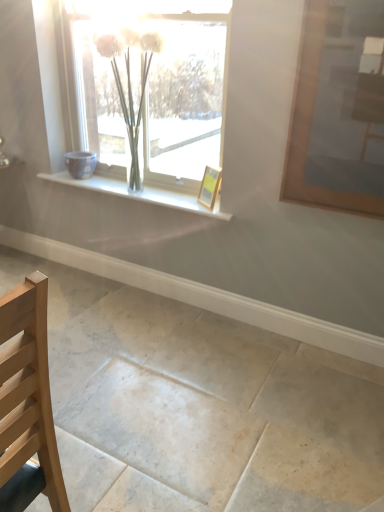
I want to click on free space to the left of wooden picture frame at center, which ranks as the second picture frame in right-to-left order, so coord(185,204).